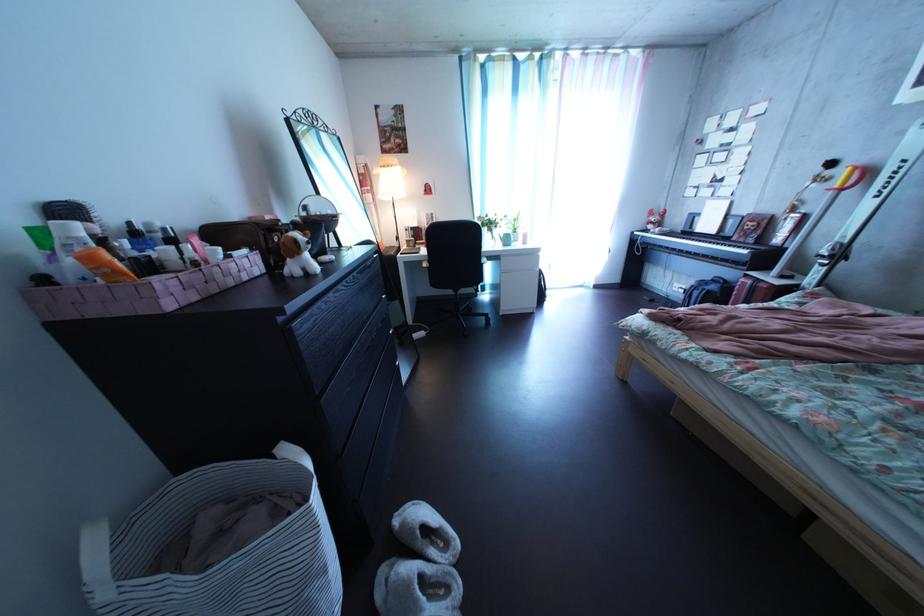
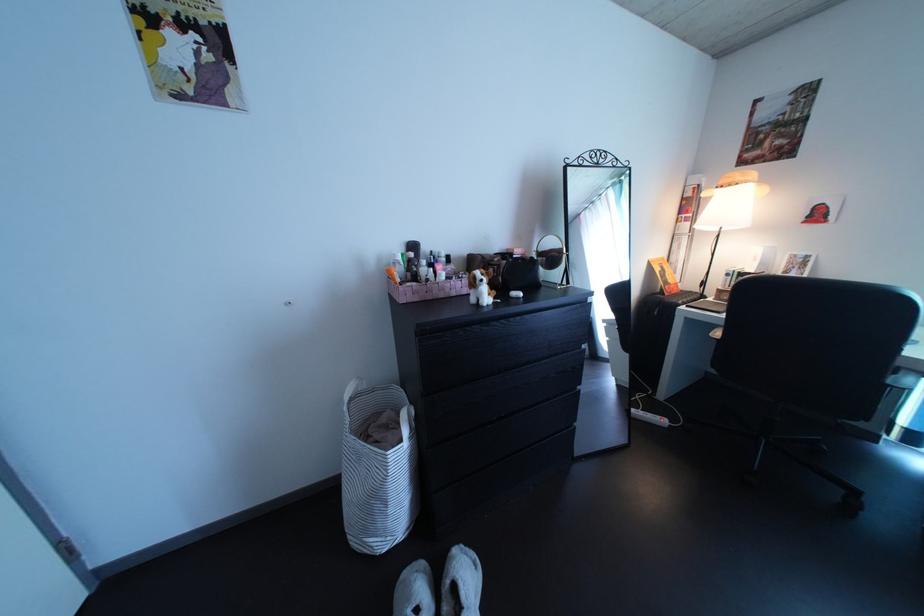
Locate, in the second image, the point that corresponds to [310,249] in the first image.

(489, 286)